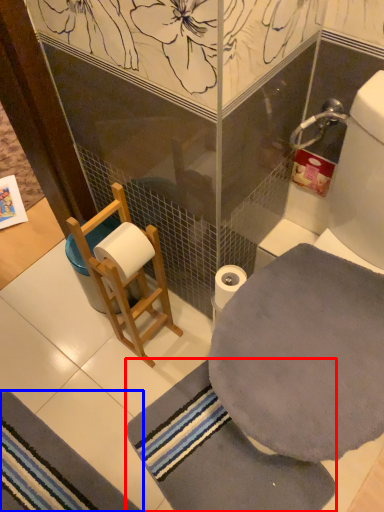
Question: Which object is further to the camera taking this photo, bath towel (highlighted by a red box) or bath mat (highlighted by a blue box)?

Choices:
 (A) bath towel
 (B) bath mat

Answer: (B)